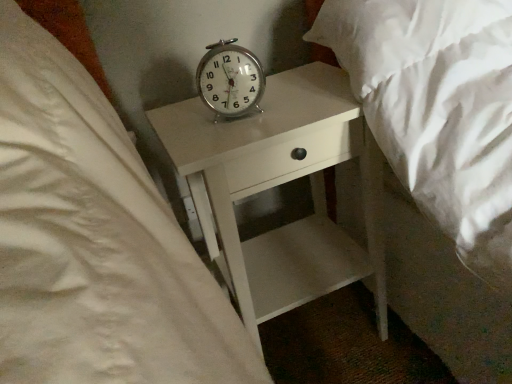
Question: Is the depth of metallic silver alarm clock at center greater than that of white glossy nightstand at center?

Choices:
 (A) yes
 (B) no

Answer: (A)

Question: Considering the relative positions of metallic silver alarm clock at center and white glossy nightstand at center in the image provided, is metallic silver alarm clock at center to the right of white glossy nightstand at center from the viewer's perspective?

Choices:
 (A) no
 (B) yes

Answer: (A)

Question: Is metallic silver alarm clock at center facing away from white glossy nightstand at center?

Choices:
 (A) yes
 (B) no

Answer: (B)

Question: Is white glossy nightstand at center inside metallic silver alarm clock at center?

Choices:
 (A) no
 (B) yes

Answer: (A)

Question: Does metallic silver alarm clock at center have a lesser height compared to white glossy nightstand at center?

Choices:
 (A) yes
 (B) no

Answer: (A)

Question: From a real-world perspective, is metallic silver alarm clock at center located beneath white glossy nightstand at center?

Choices:
 (A) yes
 (B) no

Answer: (B)

Question: Is white glossy nightstand at center outside metallic silver alarm clock at center?

Choices:
 (A) no
 (B) yes

Answer: (B)

Question: Can you confirm if white glossy nightstand at center is bigger than metallic silver alarm clock at center?

Choices:
 (A) no
 (B) yes

Answer: (B)

Question: Is white glossy nightstand at center facing towards metallic silver alarm clock at center?

Choices:
 (A) yes
 (B) no

Answer: (B)

Question: Is white glossy nightstand at center next to metallic silver alarm clock at center and touching it?

Choices:
 (A) yes
 (B) no

Answer: (B)

Question: Can you confirm if white glossy nightstand at center is smaller than metallic silver alarm clock at center?

Choices:
 (A) no
 (B) yes

Answer: (A)

Question: Is white glossy nightstand at center at the left side of metallic silver alarm clock at center?

Choices:
 (A) yes
 (B) no

Answer: (B)

Question: From their relative heights in the image, would you say metallic silver alarm clock at center is taller or shorter than white glossy nightstand at center?

Choices:
 (A) tall
 (B) short

Answer: (B)